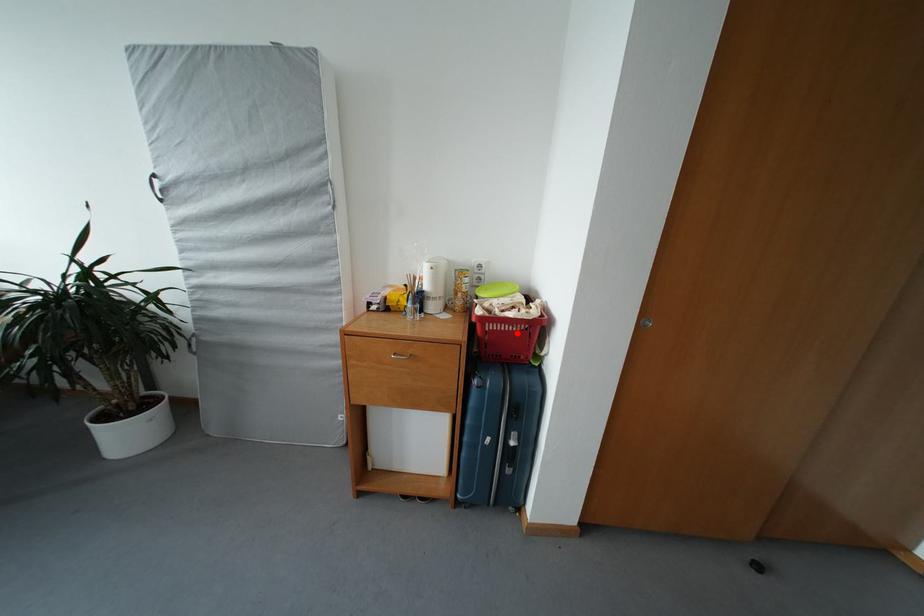
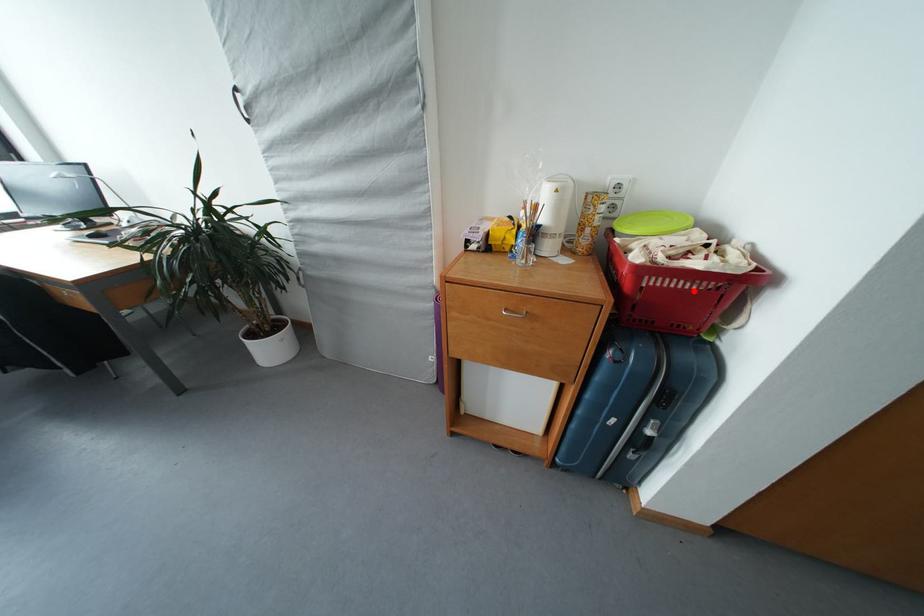
I am providing you with two images of the same scene from different viewpoints. A red point is marked on the first image and another point is marked on the second image. Do the highlighted points in image1 and image2 indicate the same real-world spot?

Yes